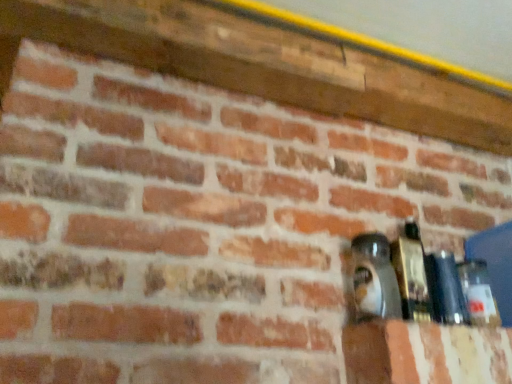
Question: In the image, is matte glass bottle at right, acting as the 2th bottle starting from the left, positioned in front of or behind matte black bottle at right, the 2th bottle in the right-to-left sequence?

Choices:
 (A) behind
 (B) front

Answer: (B)

Question: Is matte glass bottle at right, the third bottle from the right, to the left or to the right of matte black bottle at right, the 2th bottle in the right-to-left sequence, in the image?

Choices:
 (A) left
 (B) right

Answer: (A)

Question: Based on their relative distances, which object is nearer to the matte glass bottle at right, the third bottle from the right?

Choices:
 (A) matte black bottle at right, the first bottle viewed from the left
 (B) clear glass bottle at right, positioned as the first bottle in right-to-left order
 (C) matte black bottle at right, the 2th bottle in the right-to-left sequence

Answer: (A)

Question: Which object is the farthest from the matte black bottle at right, the 2th bottle in the right-to-left sequence?

Choices:
 (A) clear glass bottle at right, marked as the fourth bottle in a left-to-right arrangement
 (B) matte glass bottle at right, acting as the 2th bottle starting from the left
 (C) matte black bottle at right, the first bottle viewed from the left

Answer: (C)